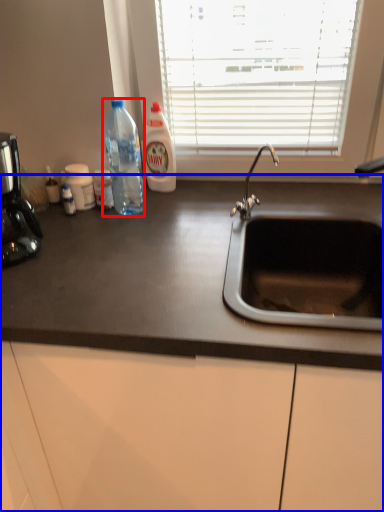
Question: Among these objects, which one is farthest to the camera, bottle (highlighted by a red box) or countertop (highlighted by a blue box)?

Choices:
 (A) bottle
 (B) countertop

Answer: (A)